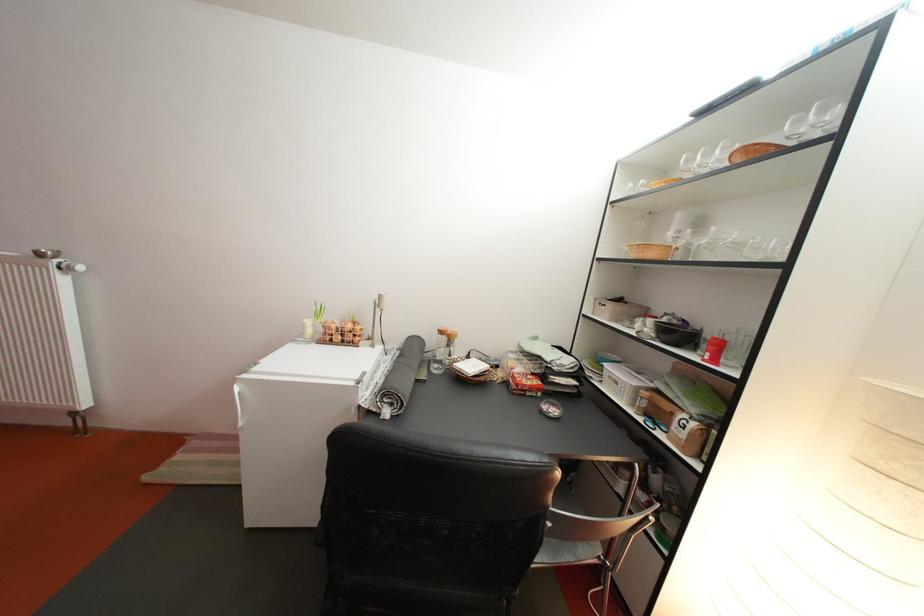
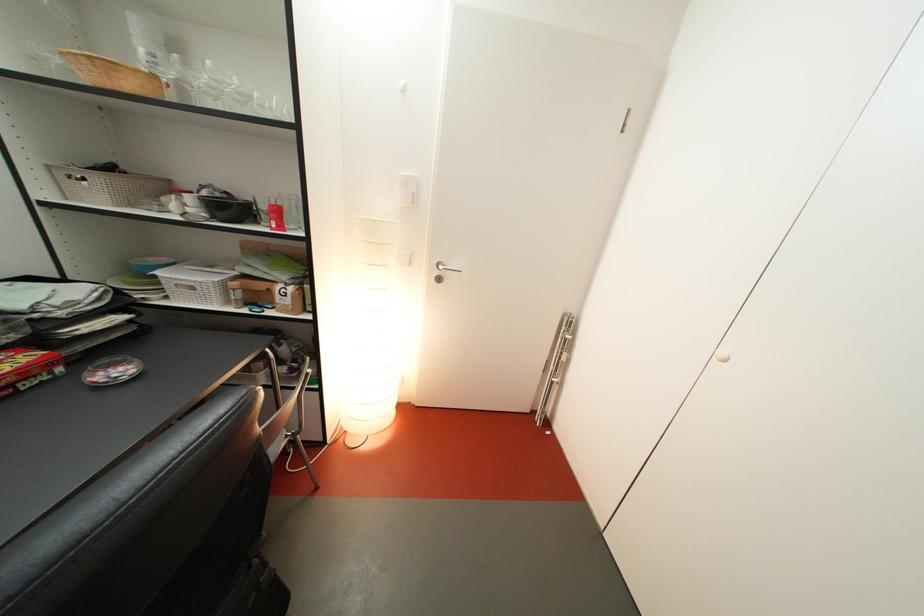
The point at (630, 306) is marked in the first image. Where is the corresponding point in the second image?

(122, 175)